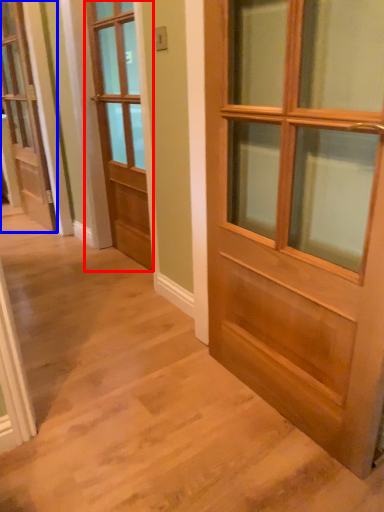
Question: Among these objects, which one is nearest to the camera, door (highlighted by a red box) or door (highlighted by a blue box)?

Choices:
 (A) door
 (B) door

Answer: (A)